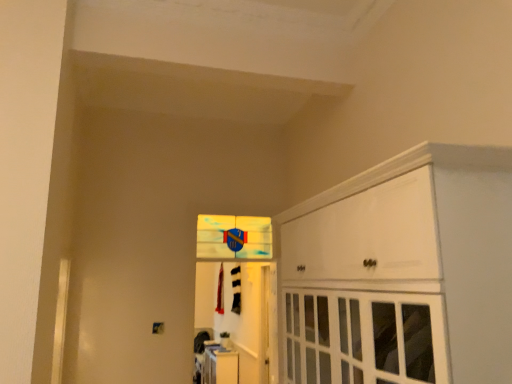
Question: Looking at their shapes, would you say white glossy door at center is wider or thinner than white glossy cabinet at lower center, which is counted as the 2th cabinetry, starting from the top?

Choices:
 (A) wide
 (B) thin

Answer: (B)

Question: Is point [x=228, y=226] positioned closer to the camera than point [x=209, y=349]?

Choices:
 (A) farther
 (B) closer

Answer: (B)

Question: Estimate the real-world distances between objects in this image. Which object is closer to the white glossy door at center?

Choices:
 (A) translucent glass window at center
 (B) white glossy cabinet at upper right, marked as the 1th cabinetry in a front-to-back arrangement
 (C) white glossy cabinet at lower center, which appears as the first cabinetry when ordered from the bottom

Answer: (C)

Question: Which object is the closest to the white glossy cabinet at upper right, which is counted as the second cabinetry, starting from the back?

Choices:
 (A) white glossy cabinet at lower center, positioned as the first cabinetry in back-to-front order
 (B) white glossy door at center
 (C) translucent glass window at center

Answer: (C)